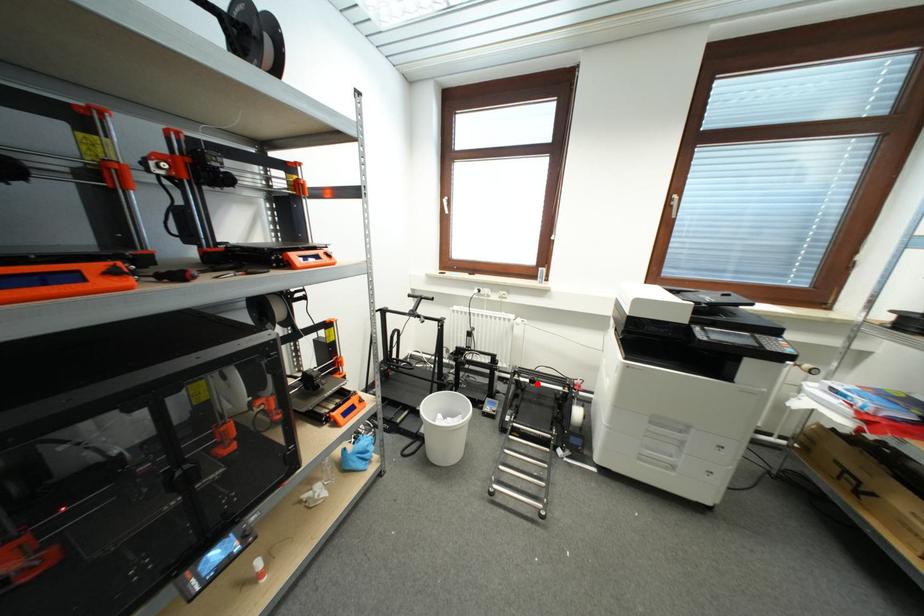
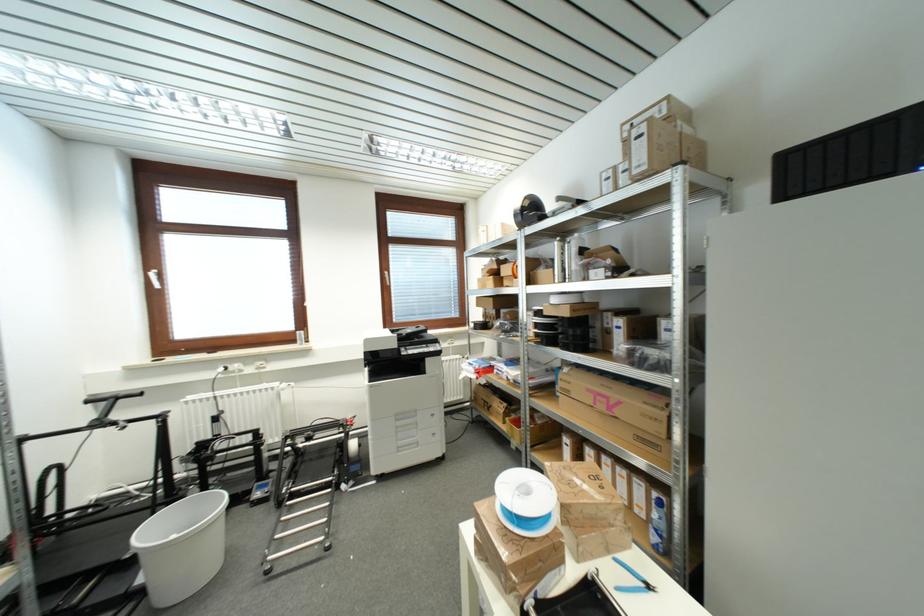
Question: I am providing you with two images of the same scene from different viewpoints. A red point is marked on the first image. Is the red point's position out of view in image 2?

Choices:
 (A) Yes
 (B) No

Answer: (B)